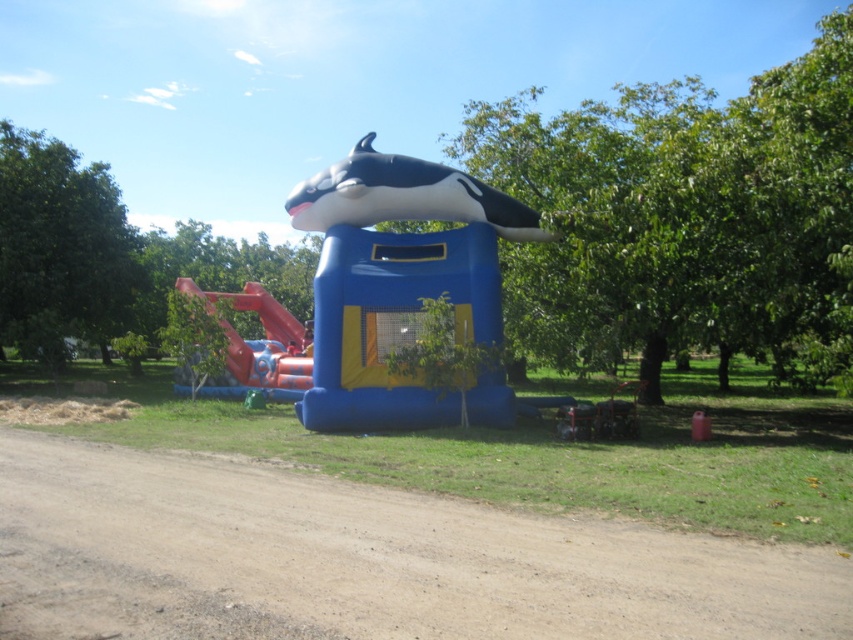
Question: Which of the following is the closest to the observer?

Choices:
 (A) (438, 198)
 (B) (265, 348)

Answer: (A)

Question: Which point appears closest to the camera in this image?

Choices:
 (A) (370, 156)
 (B) (231, 340)

Answer: (A)

Question: Can you confirm if black matte whale at center is smaller than orange matte slide at center?

Choices:
 (A) no
 (B) yes

Answer: (B)

Question: Can you confirm if black matte whale at center is positioned to the left of orange matte slide at center?

Choices:
 (A) yes
 (B) no

Answer: (B)

Question: Does black matte whale at center have a greater width compared to orange matte slide at center?

Choices:
 (A) no
 (B) yes

Answer: (B)